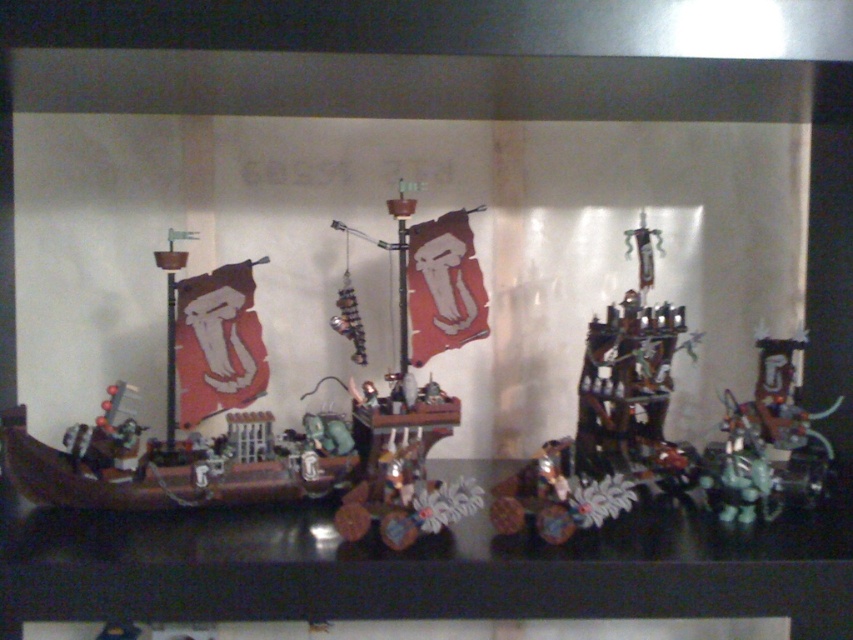
Who is taller, metallic silver ship at center or shiny dark brown ship at center-right?

metallic silver ship at center is taller.

Can you confirm if metallic silver ship at center is wider than shiny dark brown ship at center-right?

Indeed, metallic silver ship at center has a greater width compared to shiny dark brown ship at center-right.

Locate an element on the screen. The width and height of the screenshot is (853, 640). metallic silver ship at center is located at coordinates (416, 384).

Locate an element on the screen. The image size is (853, 640). metallic silver ship at center is located at coordinates (416, 384).